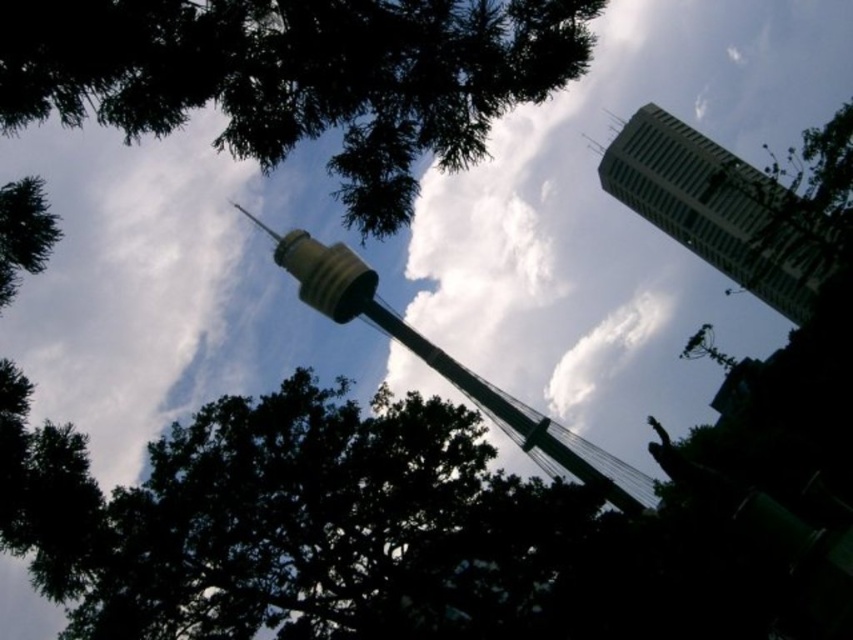
Question: Which object is closer to the camera taking this photo?

Choices:
 (A) green metallic tower at center
 (B) dark green leafy tree at lower center

Answer: (B)

Question: Which point is closer to the camera?

Choices:
 (A) dark green leafy tree at lower center
 (B) green metallic tower at center

Answer: (A)

Question: Can you confirm if dark green leafy tree at lower center is bigger than green leafy tree at upper left?

Choices:
 (A) no
 (B) yes

Answer: (B)

Question: Is dark green leafy tree at lower center behind green metallic tower at center?

Choices:
 (A) no
 (B) yes

Answer: (A)

Question: From the image, what is the correct spatial relationship of green leafy tree at upper left in relation to green metallic tower at center?

Choices:
 (A) right
 (B) left

Answer: (B)

Question: Among these points, which one is farthest from the camera?

Choices:
 (A) (207, 548)
 (B) (578, 451)

Answer: (B)